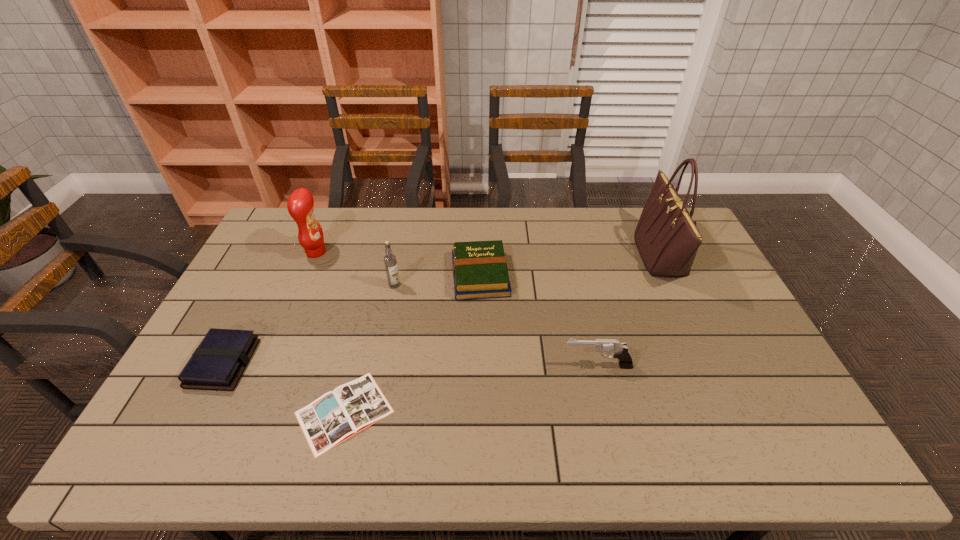
Identify the location of the rightmost object. (667, 238).

This screenshot has height=540, width=960. Find the location of `handbag`. handbag is located at coordinates (667, 238).

You are a GUI agent. You are given a task and a screenshot of the screen. Output one action in this format:
    pyautogui.click(x=<x>, y=<y>)
    Task: Click on the condiment
    The height and width of the screenshot is (540, 960).
    Given the screenshot: What is the action you would take?
    pyautogui.click(x=300, y=205)

Find the location of a particular element. the second tallest object is located at coordinates (300, 205).

Where is `the fifth shortest object`? the fifth shortest object is located at coordinates (390, 261).

This screenshot has width=960, height=540. I want to click on the fourth shortest object, so click(619, 350).

Locate an element on the screen. Image resolution: width=960 pixels, height=540 pixels. the second object from right to left is located at coordinates (619, 350).

This screenshot has width=960, height=540. I want to click on the rightmost book, so click(x=480, y=271).

This screenshot has height=540, width=960. In order to click on the tallest book in this screenshot , I will do `click(480, 271)`.

What are the coordinates of `the leftmost object` in the screenshot? It's located at (219, 361).